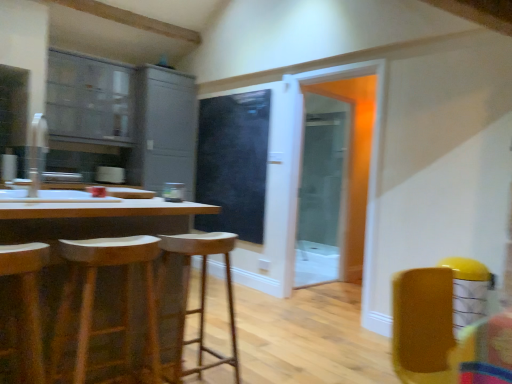
Question: Does point (327, 155) appear closer or farther from the camera than point (39, 117)?

Choices:
 (A) farther
 (B) closer

Answer: (A)

Question: From the image's perspective, is clear glass screen door at center, placed as the first screen door when sorted from right to left, above or below white glossy sink at left?

Choices:
 (A) below
 (B) above

Answer: (A)

Question: Which of these objects is positioned farthest from the clear glass screen door at center, the second screen door in the left-to-right sequence?

Choices:
 (A) matte gray cabinet at upper left, the 2th cabinetry when ordered from left to right
 (B) black matte screen door at center, which appears as the 2th screen door when viewed from the right
 (C) wooden table at left
 (D) wooden stool at left, arranged as the second stool when viewed from the back
 (E) wooden stool at center, arranged as the 1th stool when viewed from the back

Answer: (D)

Question: Estimate the real-world distances between objects in this image. Which object is closer to the wooden stool at center, arranged as the 1th stool when viewed from the back?

Choices:
 (A) matte gray cabinets at upper left, which appears as the 1th cabinetry when viewed from the left
 (B) wooden bar stool at left, arranged as the 3th stool when viewed from the back
 (C) matte gray cabinet at upper left, which is the 1th cabinetry from right to left
 (D) wooden table at left
 (E) black matte screen door at center, which appears as the 2th screen door when viewed from the right

Answer: (D)